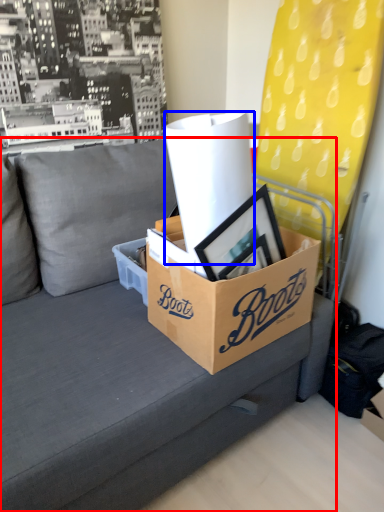
Question: Which point is further to the camera, studio couch (highlighted by a red box) or paper towel (highlighted by a blue box)?

Choices:
 (A) studio couch
 (B) paper towel

Answer: (B)